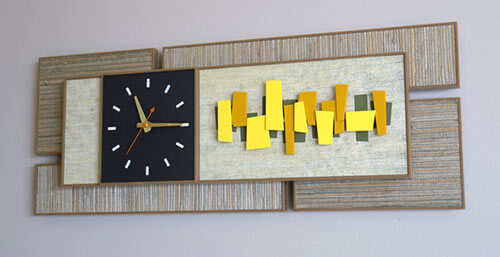
What are the coordinates of `minuite and hour hand gold on clock` in the screenshot? It's located at (145, 116), (155, 126).